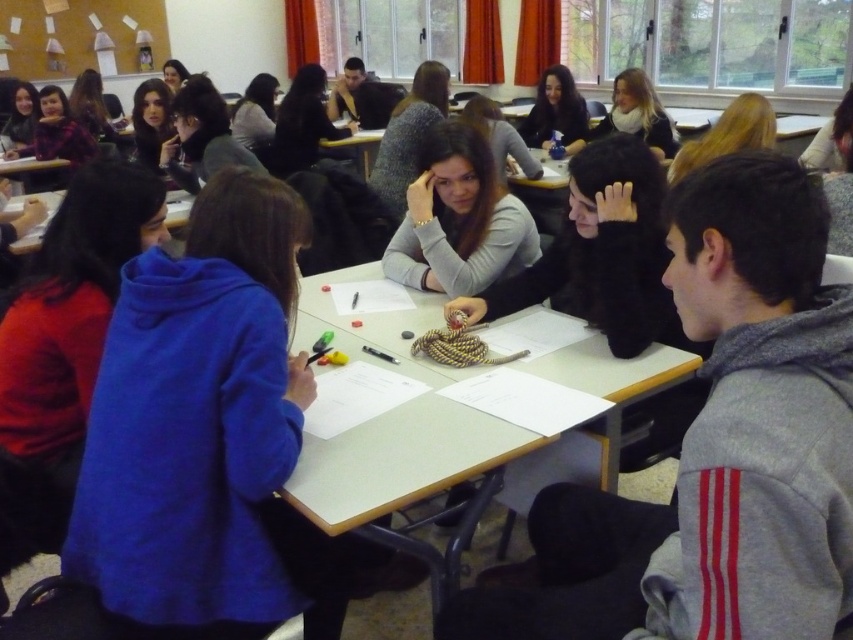
You are a student in the classroom and want to know which object is thinner between the gray fleece hoodie at right and the light brown hair at upper center. Can you determine this based on their positions?

The gray fleece hoodie at right is thinner than the light brown hair at upper center.

From the picture: You are standing at the front of the classroom and see two points on the table in front of you. Which point is closer to you, the point at coordinate (x=751, y=572) or the point at coordinate (x=659, y=113)?

The point at coordinate (x=751, y=572) is closer to you than the point at coordinate (x=659, y=113).